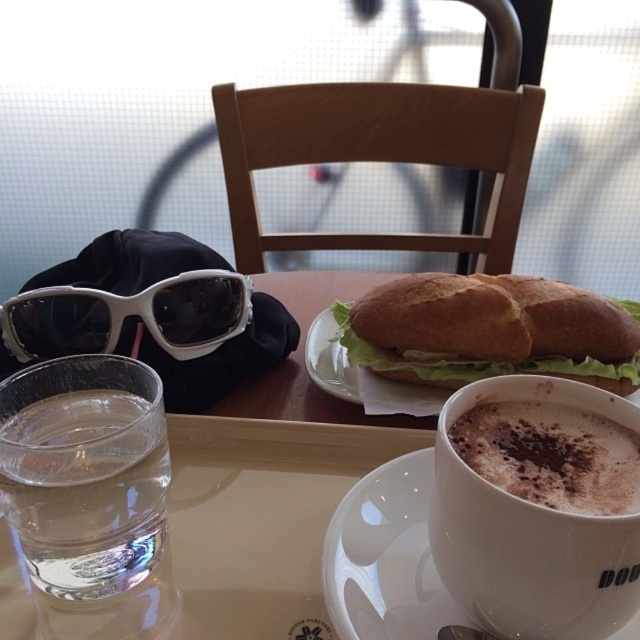
Question: Can you confirm if cappuccino foam at upper center is positioned to the left of white matte sunglasses at upper left?

Choices:
 (A) no
 (B) yes

Answer: (A)

Question: Which of the following is the closest to the observer?

Choices:
 (A) clear glass water at lower left
 (B) white matte sunglasses at upper left
 (C) cappuccino foam at upper center

Answer: (C)

Question: Among these objects, which one is farthest from the camera?

Choices:
 (A) white glossy saucer at center
 (B) white ceramic saucer at center

Answer: (A)

Question: Among these points, which one is farthest from the camera?

Choices:
 (A) (333, 612)
 (B) (538, 484)

Answer: (A)

Question: Does clear glass water at lower left appear on the left side of white ceramic saucer at center?

Choices:
 (A) no
 (B) yes

Answer: (B)

Question: Can you confirm if clear glass water at lower left is thinner than white ceramic saucer at center?

Choices:
 (A) yes
 (B) no

Answer: (A)